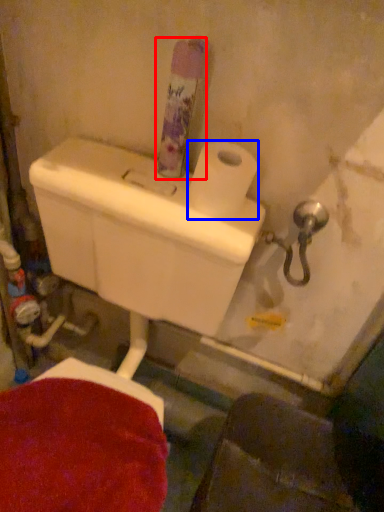
Question: Among these objects, which one is farthest to the camera, toiletry (highlighted by a red box) or toilet paper (highlighted by a blue box)?

Choices:
 (A) toiletry
 (B) toilet paper

Answer: (B)